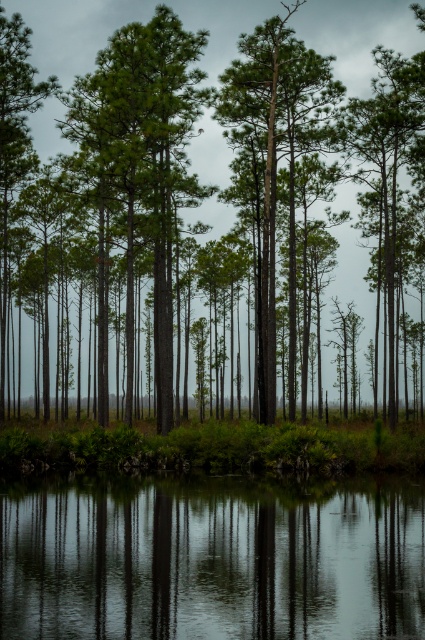
You are standing in the forest and want to cross the clear water at bottom. Based on its position, can you estimate how far it is from the center of the image?

The clear water at bottom is located at point (210, 561), which is approximately 87.7 percent from the left and 49.6 percent from the top of the image. This places it slightly to the right of the center horizontally and near the middle vertically, making it relatively close to the center.

You are standing in the forest scene and want to walk from the clear water at bottom to the green rough bark tree at center. Which direction should you move to reach the tree?

The clear water at bottom is positioned on the left side of the green rough bark tree at center, so you should move to the right to reach the tree.

You are standing in the middle of a forest and see the green matte tree at center and the green rough bark tree at center. Which tree is taller?

The green matte tree at center is bigger than the green rough bark tree at center, so it is taller.